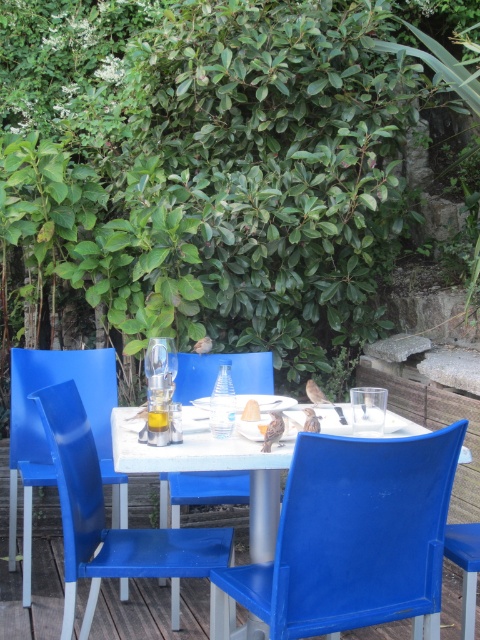
Question: Where is glossy plastic chair at center located in relation to blue plastic chair at center in the image?

Choices:
 (A) above
 (B) below

Answer: (A)

Question: Which object is positioned closest to the glossy plastic chair at left?

Choices:
 (A) glossy plastic chair at center
 (B) matte plastic chair at center

Answer: (B)

Question: Which point is closer to the camera?

Choices:
 (A) glossy plastic chair at center
 (B) blue plastic chair at center
 (C) glossy plastic chair at left

Answer: (C)

Question: Is matte plastic chair at center to the right of glossy plastic chair at left from the viewer's perspective?

Choices:
 (A) no
 (B) yes

Answer: (B)

Question: Which object appears closest to the camera in this image?

Choices:
 (A) glossy plastic chair at left
 (B) glossy plastic chair at center
 (C) blue plastic chair at center
 (D) matte plastic chair at center

Answer: (D)

Question: Is glossy plastic chair at left to the left of glossy plastic chair at center from the viewer's perspective?

Choices:
 (A) yes
 (B) no

Answer: (B)